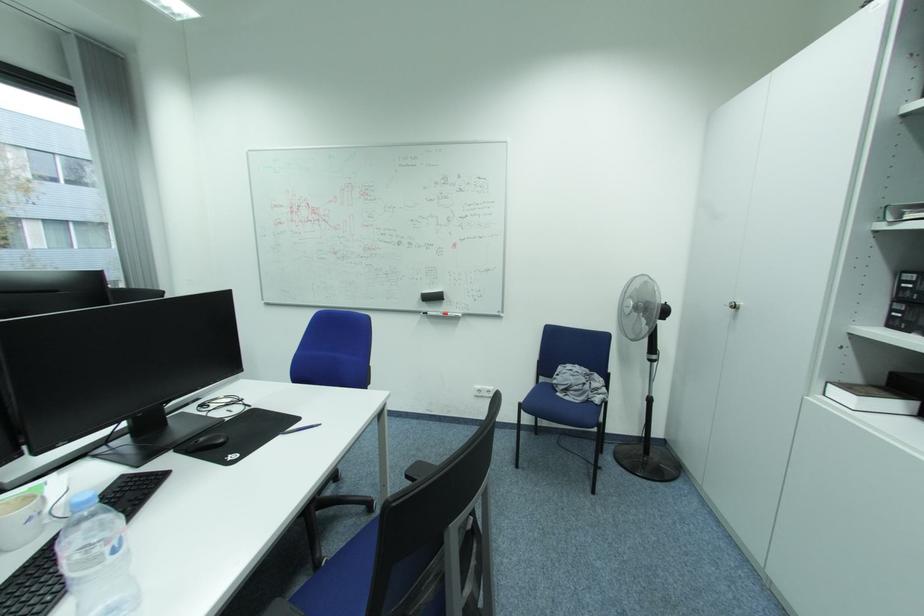
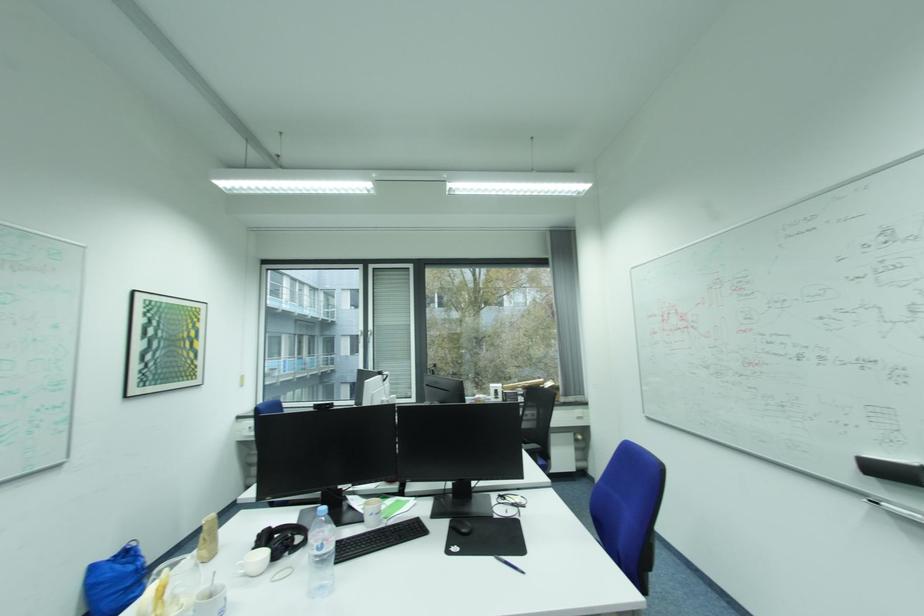
Question: The camera is either moving clockwise (left) or counter-clockwise (right) around the object. The first image is from the beginning of the video and the second image is from the end. Is the camera moving left or right when shooting the video?

Choices:
 (A) Left
 (B) Right

Answer: (B)